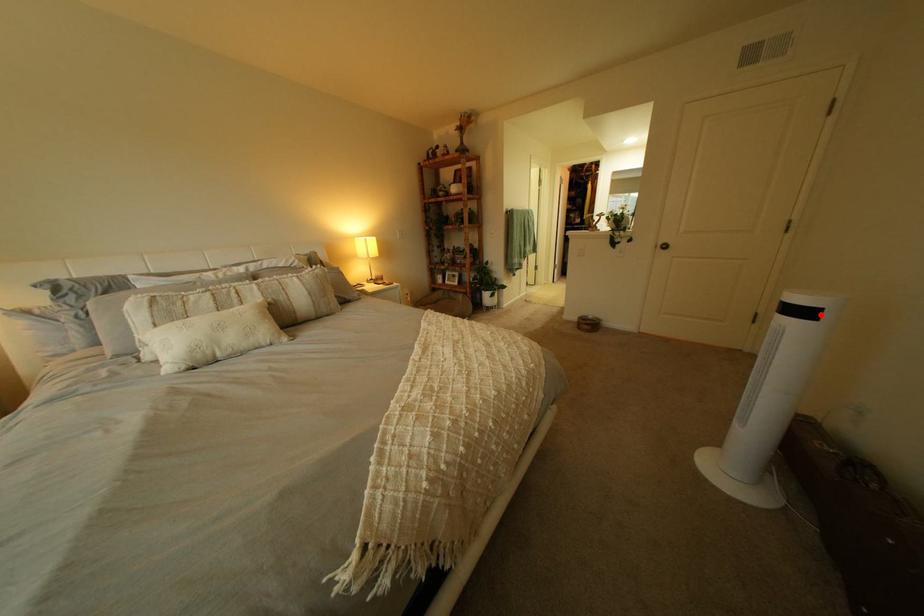
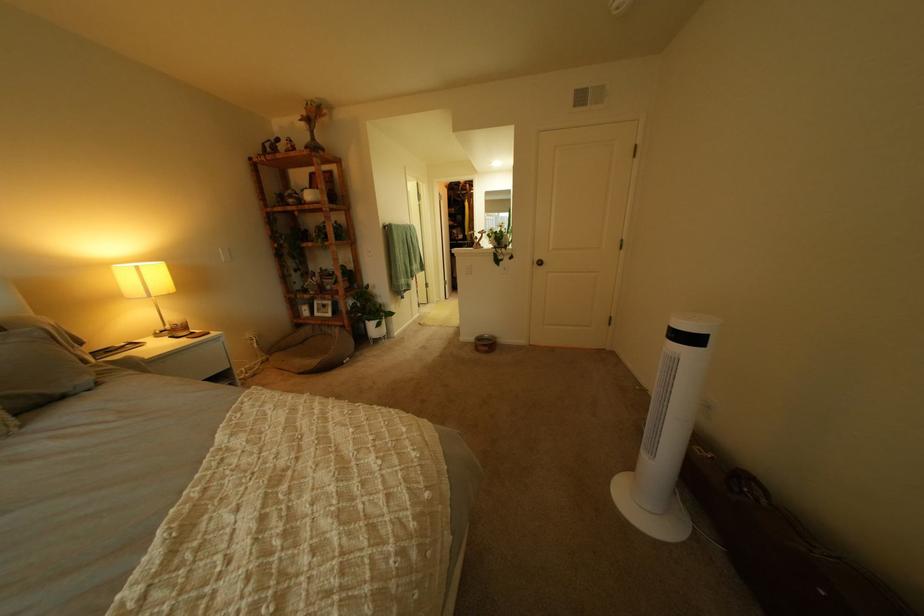
Where in the second image is the point corresponding to the highlighted location from the first image?

(710, 341)